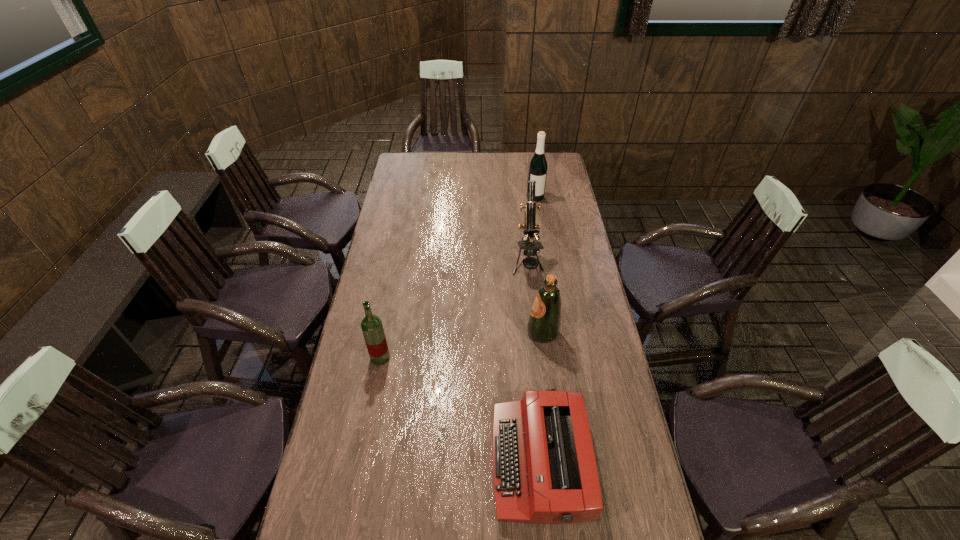
Find the location of `vacant space located on the front-facing side of the olive oil`. vacant space located on the front-facing side of the olive oil is located at coordinates (458, 333).

Identify the location of free region located on the front-facing side of the olive oil. This screenshot has width=960, height=540. coord(425,333).

You are a GUI agent. You are given a task and a screenshot of the screen. Output one action in this format:
    pyautogui.click(x=<x>, y=<y>)
    Task: Click on the vacant space located 0.110m on the front of the fourth farthest object
    The image size is (960, 540).
    Given the screenshot: What is the action you would take?
    pyautogui.click(x=373, y=395)

The image size is (960, 540). I want to click on free space located 0.240m on the typing side of the nearest object, so [x=409, y=462].

Image resolution: width=960 pixels, height=540 pixels. In order to click on free location located on the typing side of the nearest object in this screenshot , I will do `click(372, 462)`.

This screenshot has height=540, width=960. Find the location of `vacant space located on the typing side of the nearest object`. vacant space located on the typing side of the nearest object is located at coordinates (475, 462).

Find the location of a particular element. This screenshot has width=960, height=540. object present at the left edge is located at coordinates (371, 325).

Locate an element on the screen. wine bottle situated at the right edge is located at coordinates (538, 167).

Where is `typewriter located at the right edge`? typewriter located at the right edge is located at coordinates (544, 469).

In the image, there is a desktop. Where is `free region at the far edge`? This screenshot has width=960, height=540. free region at the far edge is located at coordinates (478, 159).